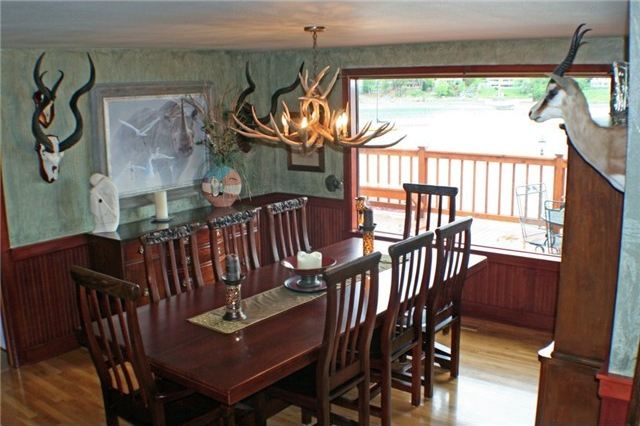
You are a GUI agent. You are given a task and a screenshot of the screen. Output one action in this format:
    pyautogui.click(x=<x>, y=<y>)
    Task: Click on the wall
    Image resolution: width=640 pixels, height=426 pixels.
    Given the screenshot: What is the action you would take?
    pyautogui.click(x=54, y=225)